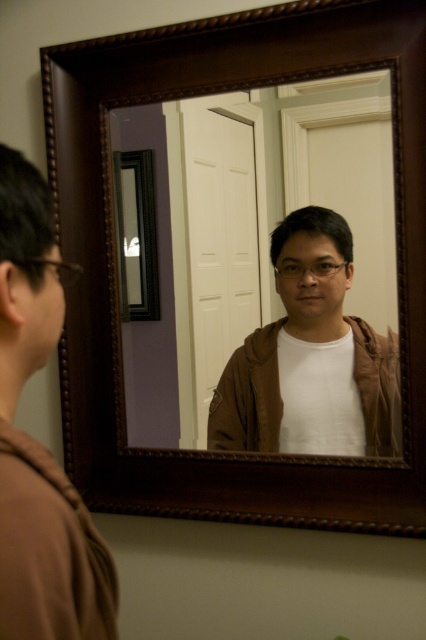
Question: Does brown wooden mirror at center lie behind brown matte jacket at center?

Choices:
 (A) yes
 (B) no

Answer: (B)

Question: Is brown matte jacket at lower left positioned before brown matte jacket at center?

Choices:
 (A) no
 (B) yes

Answer: (B)

Question: Is brown matte jacket at lower left smaller than brown matte jacket at center?

Choices:
 (A) yes
 (B) no

Answer: (A)

Question: Based on their relative distances, which object is farther from the brown wooden mirror at center?

Choices:
 (A) brown matte jacket at lower left
 (B) brown matte jacket at center

Answer: (A)

Question: Which object appears closest to the camera in this image?

Choices:
 (A) brown wooden mirror at center
 (B) brown matte jacket at center

Answer: (A)

Question: Considering the real-world distances, which object is closest to the brown matte jacket at center?

Choices:
 (A) brown wooden mirror at center
 (B) brown matte jacket at lower left

Answer: (A)